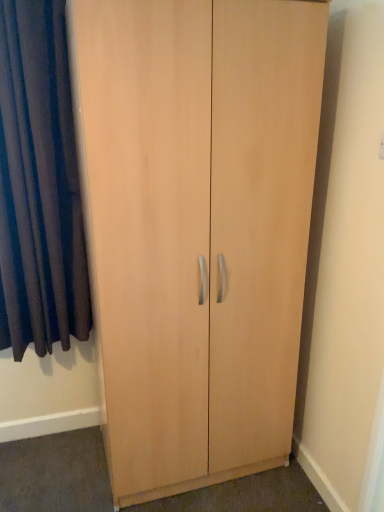
Where is `vacant area situated below dark blue velvet curtain at left (from a real-world perspective)`? The width and height of the screenshot is (384, 512). vacant area situated below dark blue velvet curtain at left (from a real-world perspective) is located at coordinates (57, 439).